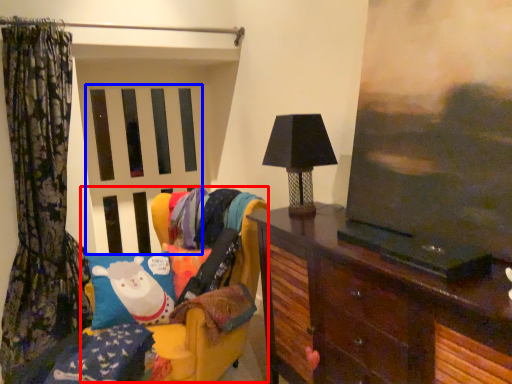
Question: Which object appears closest to the camera in this image, swivel chair (highlighted by a red box) or screen door (highlighted by a blue box)?

Choices:
 (A) swivel chair
 (B) screen door

Answer: (A)